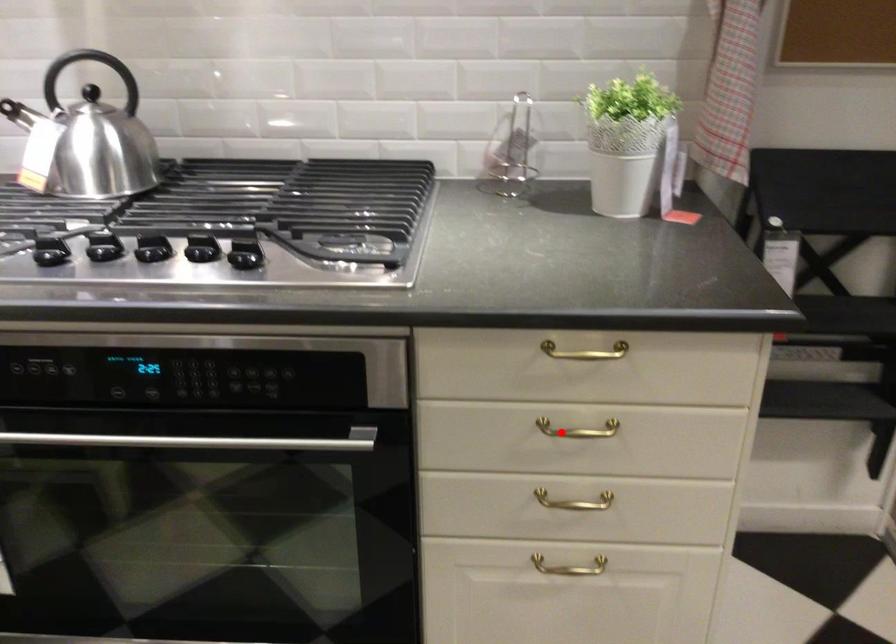
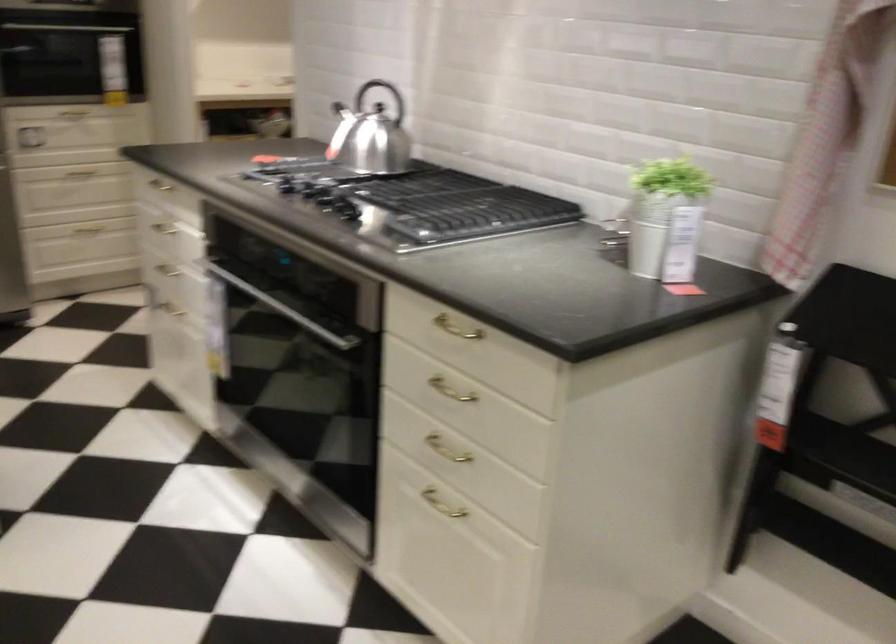
Question: I am providing you with two images of the same scene from different viewpoints. In image1, a red point is highlighted. Considering the same 3D point in image2, which of the following is correct?

Choices:
 (A) It is closer
 (B) It is farther

Answer: (B)